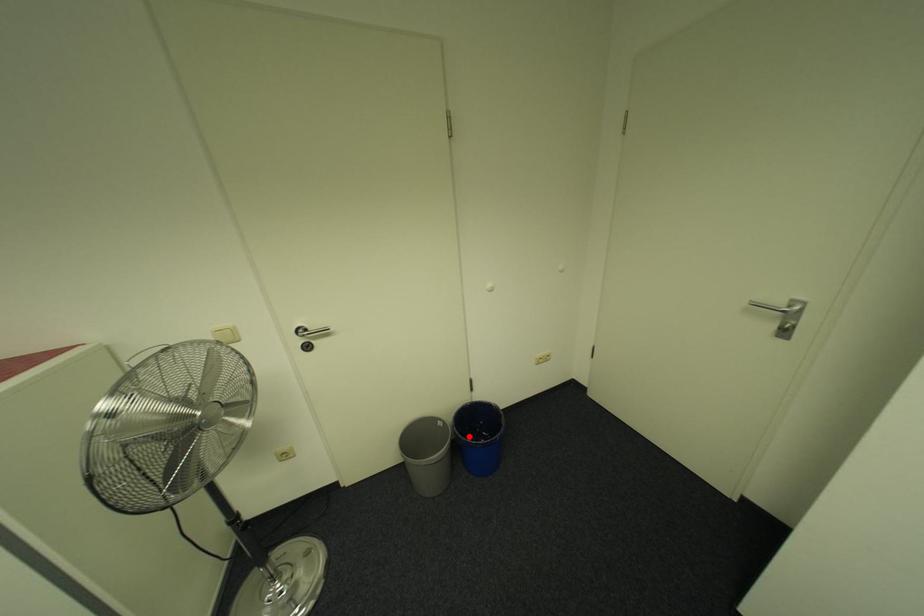
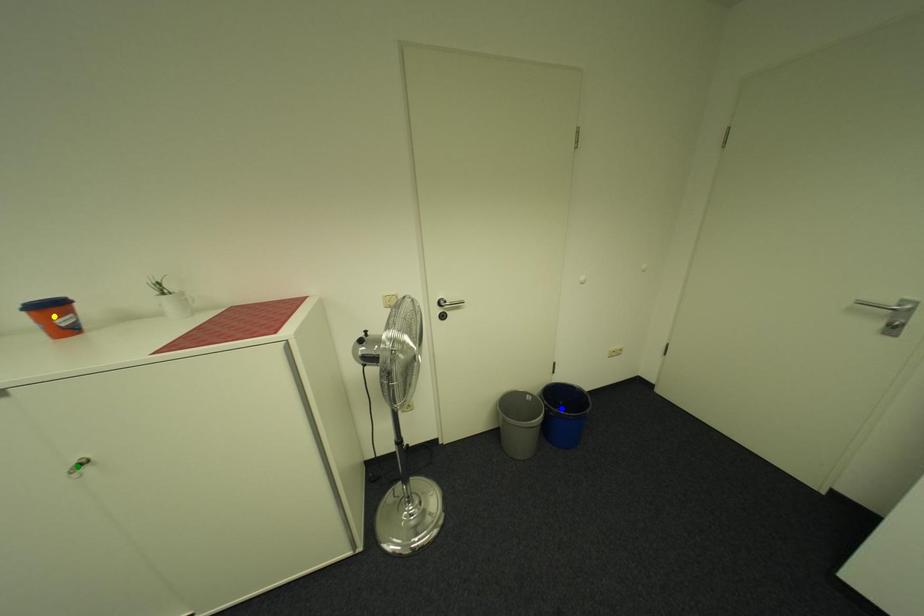
Question: I am providing you with two images of the same scene from different viewpoints. A red point is marked on the first image. You are given multiple points on the second image. Which point in image 2 represents the same 3d spot as the red point in image 1?

Choices:
 (A) yellow point
 (B) blue point
 (C) green point

Answer: (B)